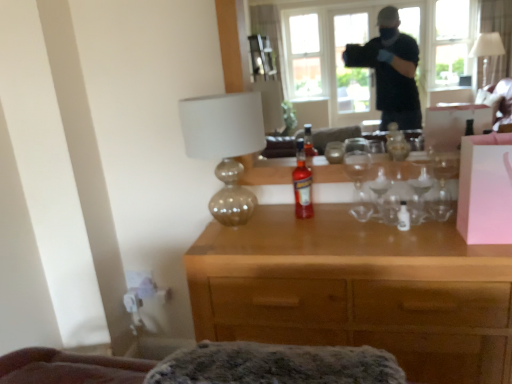
Identify the location of vacant region to the left of translucent glass bottle at center. This screenshot has height=384, width=512. (269, 231).